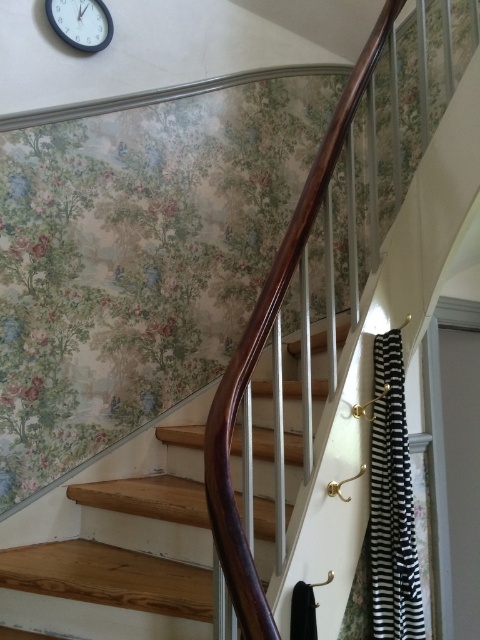
You are a painter who needs to hang a new picture frame that is 1.2 meters tall. You have two options for placement on the wall behind the wooden stairs at center and the blue glossy clock at upper left. Based on their heights, which location would allow the frame to fit without being cut off?

The wooden stairs at center is taller than the blue glossy clock at upper left. Therefore, the area behind the wooden stairs at center would provide enough vertical space to hang the 1.2 meter tall picture frame without it being cut off.

You are a painter who needs to hang a new painting. You have two spots available on the wall behind the wooden stairs at center and next to the blue glossy clock at upper left. Which spot can accommodate a wider painting?

The spot behind the wooden stairs at center can accommodate a wider painting because the wooden stairs at center is wider than the blue glossy clock at upper left.